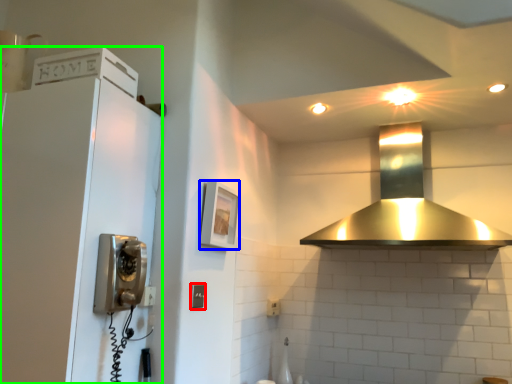
Question: Which object is positioned farthest from light switch (highlighted by a red box)? Select from picture frame (highlighted by a blue box) and appliance (highlighted by a green box).

Choices:
 (A) picture frame
 (B) appliance

Answer: (B)